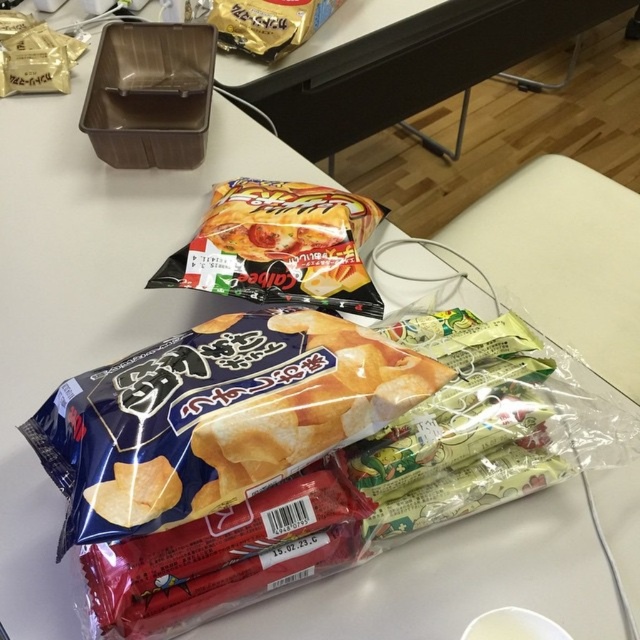
Question: Is the position of shiny plastic bag of chips at center less distant than that of gold foil snack at upper center?

Choices:
 (A) no
 (B) yes

Answer: (B)

Question: Is shiny plastic bag of chips at center bigger than gold foil snack at upper center?

Choices:
 (A) no
 (B) yes

Answer: (B)

Question: Is shiny plastic bag of chips at center wider than gold foil snack at upper center?

Choices:
 (A) no
 (B) yes

Answer: (B)

Question: Which of the following is the closest to the observer?

Choices:
 (A) gold foil snack at upper center
 (B) shiny plastic bag of chips at center

Answer: (B)